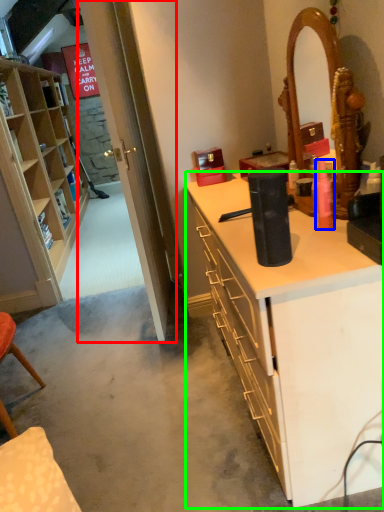
Question: Based on their relative distances, which object is nearer to glass door (highlighted by a red box)? Choose from toiletry (highlighted by a blue box) and desk (highlighted by a green box).

Choices:
 (A) toiletry
 (B) desk

Answer: (B)